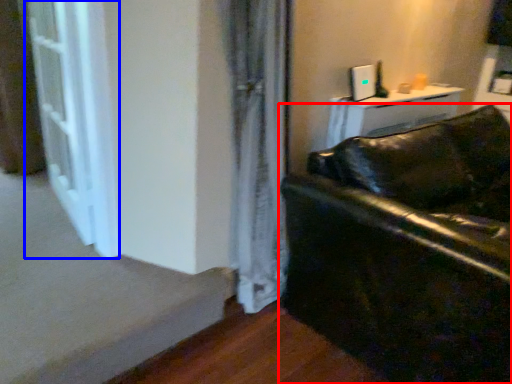
Question: Among these objects, which one is farthest to the camera, studio couch (highlighted by a red box) or screen door (highlighted by a blue box)?

Choices:
 (A) studio couch
 (B) screen door

Answer: (B)